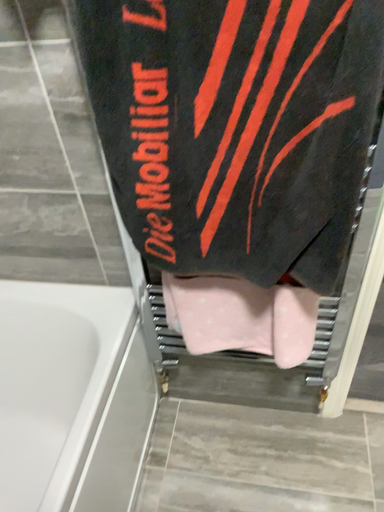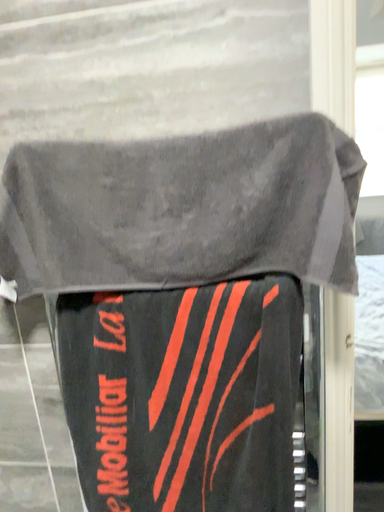
Question: Which way did the camera rotate in the video?

Choices:
 (A) rotated downward
 (B) rotated upward

Answer: (B)